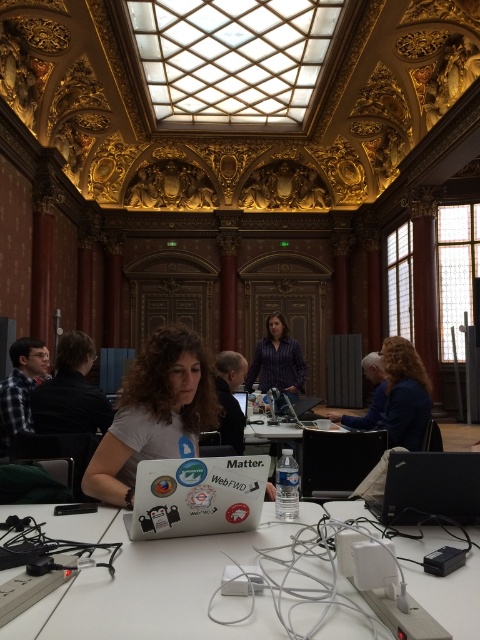
Question: Which point is farther to the camera?

Choices:
 (A) white matte laptop at center
 (B) matte purple shirt at center

Answer: (B)

Question: Estimate the real-world distances between objects in this image. Which object is farther from the matte purple shirt at center?

Choices:
 (A) white plastic table at center
 (B) white matte shirt at center

Answer: (A)

Question: Does white matte laptop at center appear over black matte laptop at lower right?

Choices:
 (A) yes
 (B) no

Answer: (A)

Question: Which point appears closest to the camera in this image?

Choices:
 (A) (184, 362)
 (B) (285, 323)

Answer: (A)

Question: Can you confirm if white plastic table at center is smaller than matte blue shirt at right?

Choices:
 (A) no
 (B) yes

Answer: (B)

Question: Is white matte laptop at center wider than matte blue shirt at right?

Choices:
 (A) yes
 (B) no

Answer: (B)